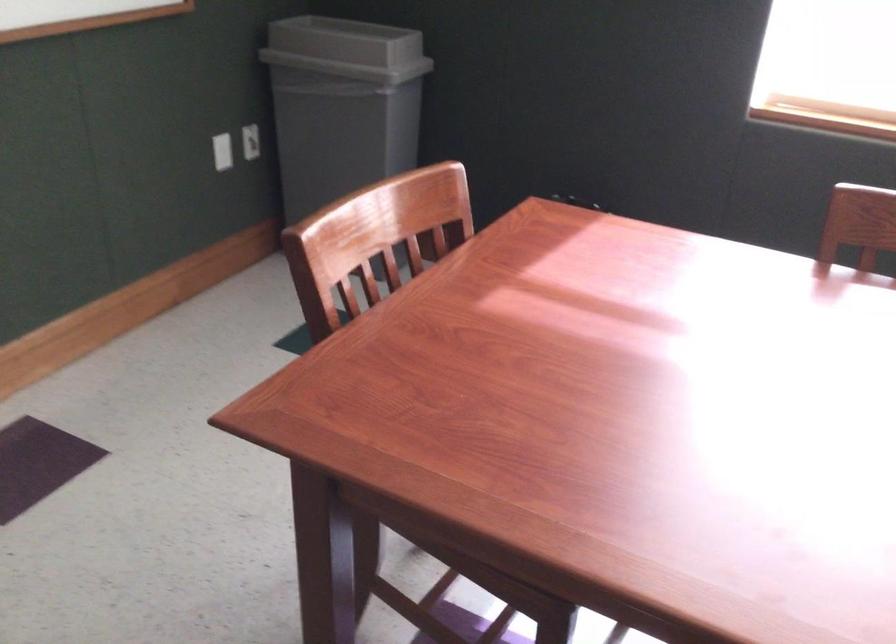
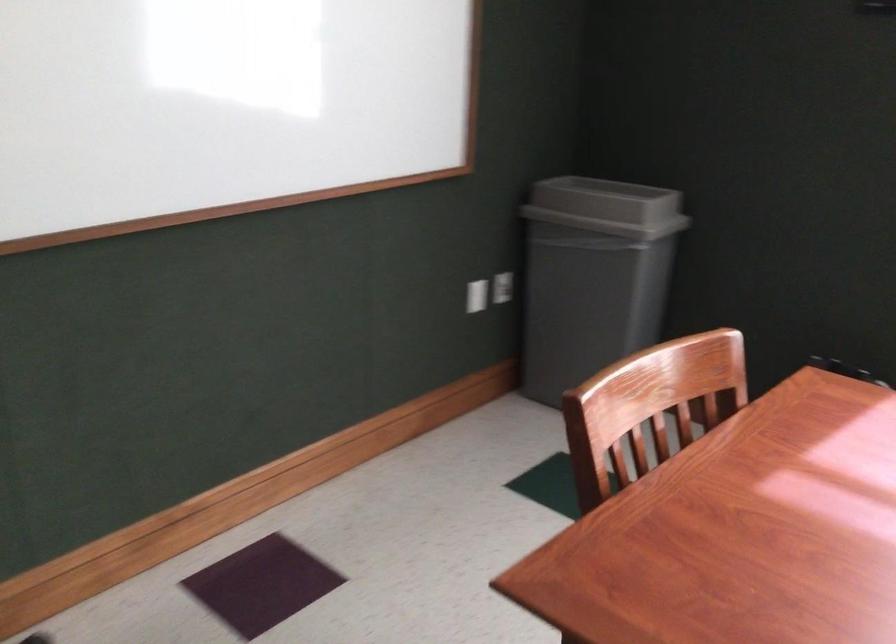
The point at [227,152] is marked in the first image. Where is the corresponding point in the second image?

(477, 295)